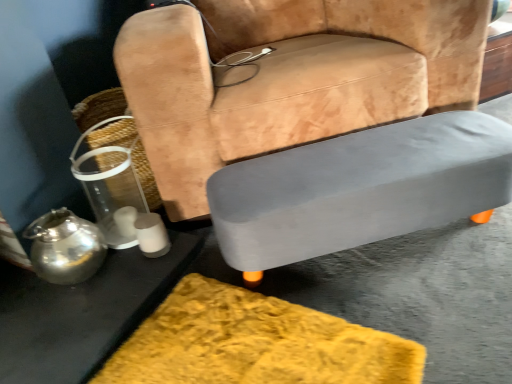
Question: Is point (435, 150) positioned closer to the camera than point (24, 276)?

Choices:
 (A) farther
 (B) closer

Answer: (B)

Question: Considering the relative positions of gray matte table at lower right, the 2th table when ordered from left to right, and metallic silver table at lower left, the second table in the right-to-left sequence, in the image provided, is gray matte table at lower right, the 2th table when ordered from left to right, to the left or to the right of metallic silver table at lower left, the second table in the right-to-left sequence,?

Choices:
 (A) right
 (B) left

Answer: (A)

Question: Based on their relative distances, which object is nearer to the metallic silver table at lower left, the second table in the right-to-left sequence?

Choices:
 (A) gray matte table at lower right, the 1th table when ordered from right to left
 (B) suede-like tan chair at center
 (C) shiny metallic teapot at lower left
 (D) clear plastic basket at left

Answer: (C)

Question: Estimate the real-world distances between objects in this image. Which object is farther from the gray matte table at lower right, the 1th table when ordered from right to left?

Choices:
 (A) suede-like tan chair at center
 (B) metallic silver table at lower left, the second table in the right-to-left sequence
 (C) clear plastic basket at left
 (D) shiny metallic teapot at lower left

Answer: (C)